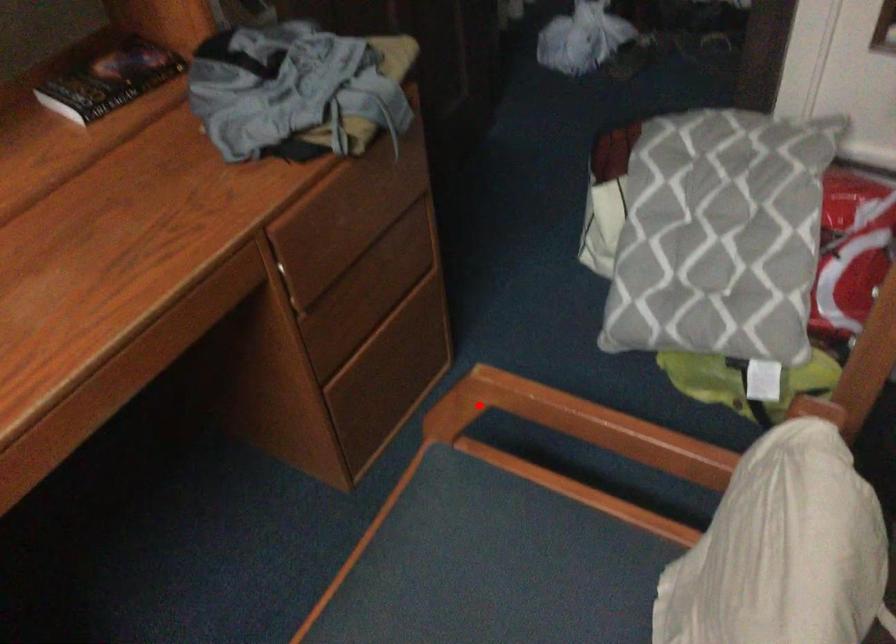
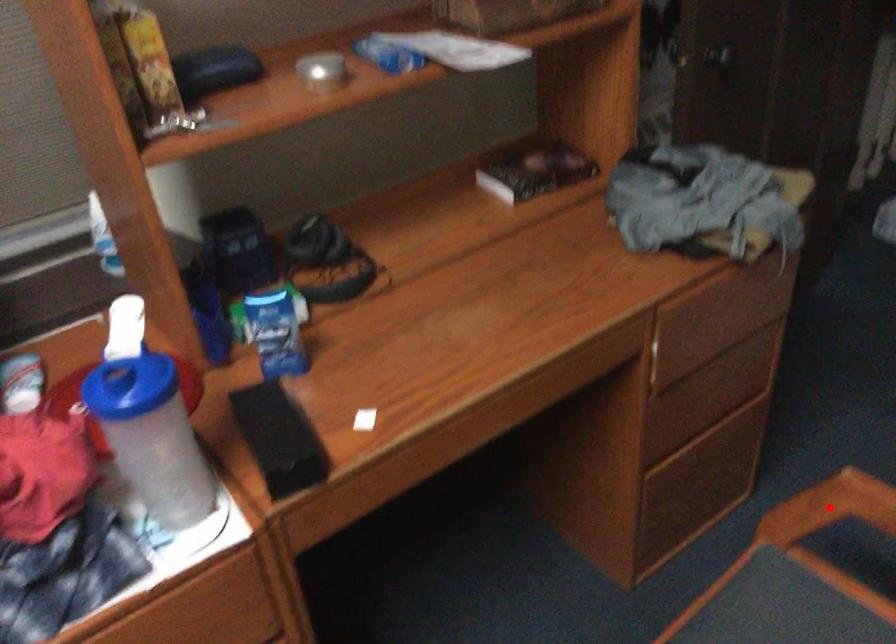
I am providing you with two images of the same scene from different viewpoints. A red point is marked on the first image and another point is marked on the second image. Are the points marked in image1 and image2 representing the same 3D position?

Yes